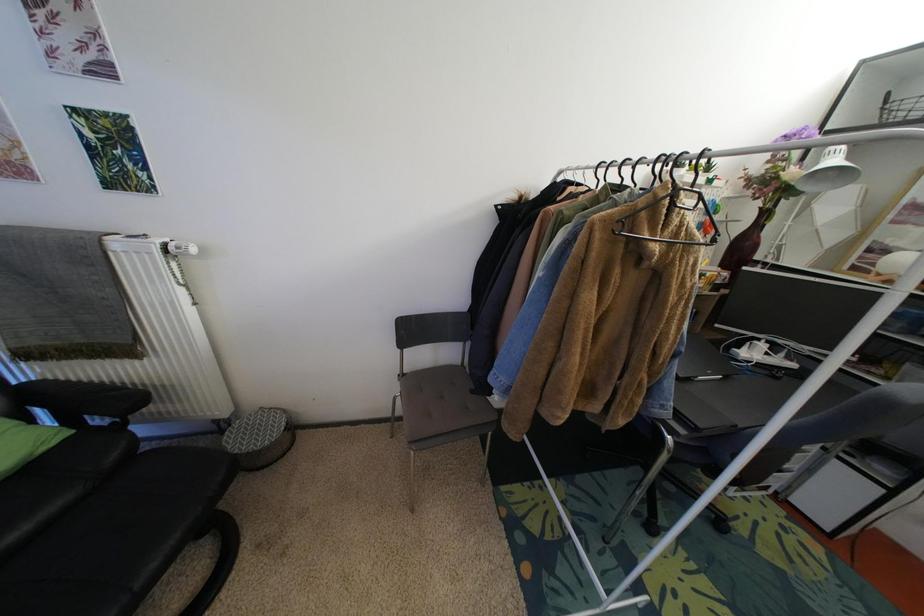
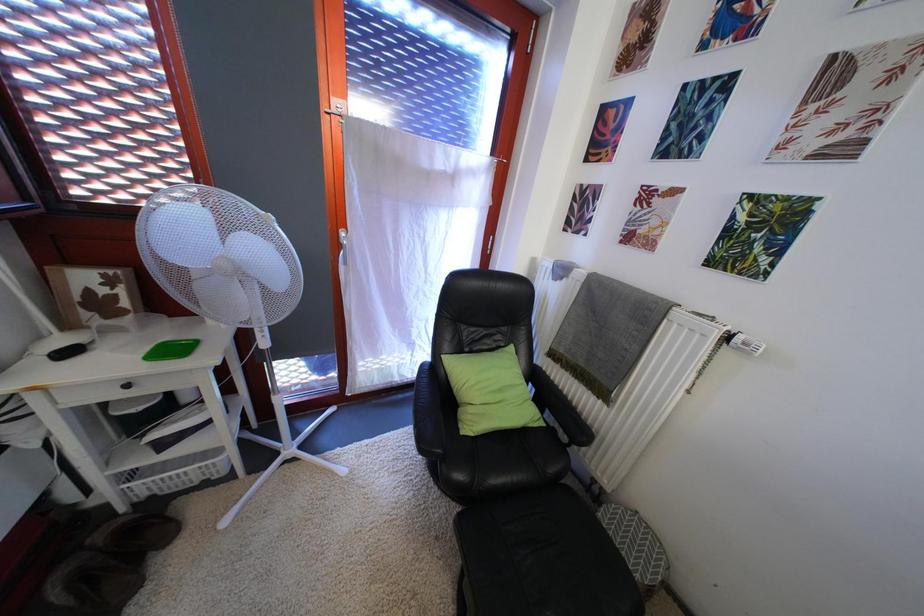
Question: The camera is either moving clockwise (left) or counter-clockwise (right) around the object. The first image is from the beginning of the video and the second image is from the end. Is the camera moving left or right when shooting the video?

Choices:
 (A) Left
 (B) Right

Answer: (B)